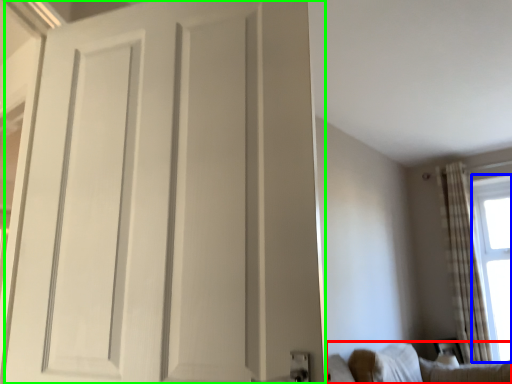
Question: Which object is the farthest from furniture (highlighted by a red box)? Choose among these: window screen (highlighted by a blue box) or door (highlighted by a green box).

Choices:
 (A) window screen
 (B) door

Answer: (B)